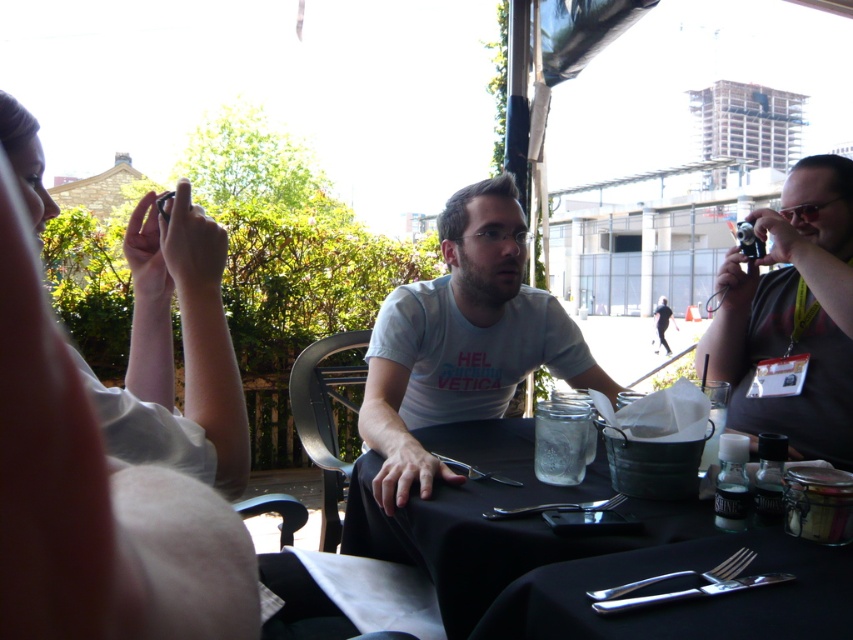
Is black matte table at center behind matte black camera at right?

No, black matte table at center is in front of matte black camera at right.

Which is below, black matte table at center or matte black camera at right?

black matte table at center is below.

Who is more distant from viewer, (692,563) or (701,349)?

Positioned behind is point (701,349).

Where is `black matte table at center`? Image resolution: width=853 pixels, height=640 pixels. black matte table at center is located at coordinates (543, 547).

Is point (480, 493) closer to viewer compared to point (460, 364)?

Yes.

Which is in front, point (486, 483) or point (489, 400)?

Point (486, 483) is more forward.

Is point (433, 536) farther from camera compared to point (560, 342)?

That is False.

The width and height of the screenshot is (853, 640). Identify the location of black matte table at center. (543, 547).

Who is higher up, white cotton shirt at center or matte black camera at right?

matte black camera at right is above.

You are a GUI agent. You are given a task and a screenshot of the screen. Output one action in this format:
    pyautogui.click(x=<x>, y=<y>)
    Task: Click on the white cotton shirt at center
    
    Given the screenshot: What is the action you would take?
    pyautogui.click(x=462, y=340)

At what (x,y) coordinates should I click in order to perform the action: click on white cotton shirt at center. Please return your answer as a coordinate pair (x, y). This screenshot has height=640, width=853. Looking at the image, I should click on (462, 340).